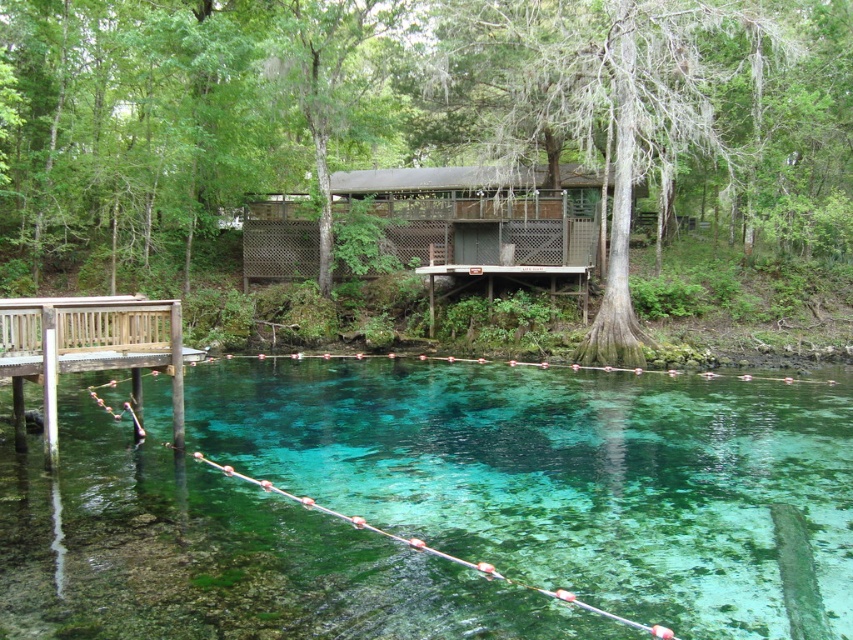
Does clear glassy water at center have a lesser height compared to gray mossy tree at center?

Correct, clear glassy water at center is not as tall as gray mossy tree at center.

Between clear glassy water at center and gray mossy tree at center, which one appears on the right side from the viewer's perspective?

Positioned to the right is gray mossy tree at center.

Is point (334, 433) farther from camera compared to point (753, 108)?

No, (334, 433) is closer to viewer.

The height and width of the screenshot is (640, 853). What are the coordinates of `clear glassy water at center` in the screenshot? It's located at (561, 474).

Does green mossy tree at center appear under brown wooden cabin at center?

Actually, green mossy tree at center is above brown wooden cabin at center.

Which of these two, green mossy tree at center or brown wooden cabin at center, stands shorter?

With less height is brown wooden cabin at center.

Locate an element on the screen. The height and width of the screenshot is (640, 853). green mossy tree at center is located at coordinates (421, 138).

The image size is (853, 640). Find the location of `green mossy tree at center`. green mossy tree at center is located at coordinates (421, 138).

From the picture: Is gray mossy tree at center behind wooden dock at left?

Yes, gray mossy tree at center is further from the viewer.

This screenshot has width=853, height=640. What do you see at coordinates (627, 109) in the screenshot?
I see `gray mossy tree at center` at bounding box center [627, 109].

Locate an element on the screen. This screenshot has width=853, height=640. gray mossy tree at center is located at coordinates (627, 109).